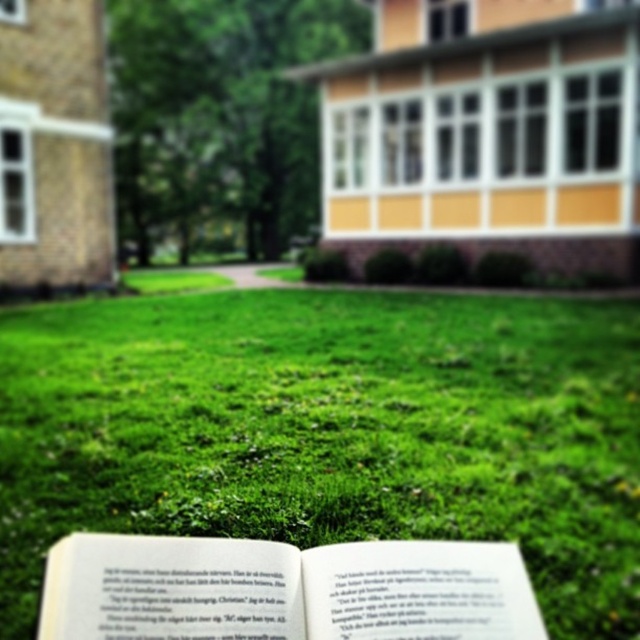
You are a photographer trying to capture a detailed shot of the white paper book at center while standing close to the green grass at center. Since the grass is in front of the book, will you need to adjust your position to focus on the book without the grass blocking it?

The green grass at center is further to the viewer than the white paper book at center, so the grass is actually behind the book. Therefore, you don not need to adjust your position because the book is closer to you and the grass won not block the view.

You are a photographer wanting to capture a closeup of the green grass at center while keeping the white paper book at center in focus. Given that your camera has a depth of field of 5 meters, will you be able to achieve this?

The green grass at center is 4.96 meters away from the white paper book at center. Since the distance between them is within the camera depth of field of 5 meters, you can achieve both in focus.

You are standing at the point labeled as point (330, 429) in the image. What is the immediate surface you are standing on?

The immediate surface you are standing on at point (330, 429) is green grass at center.